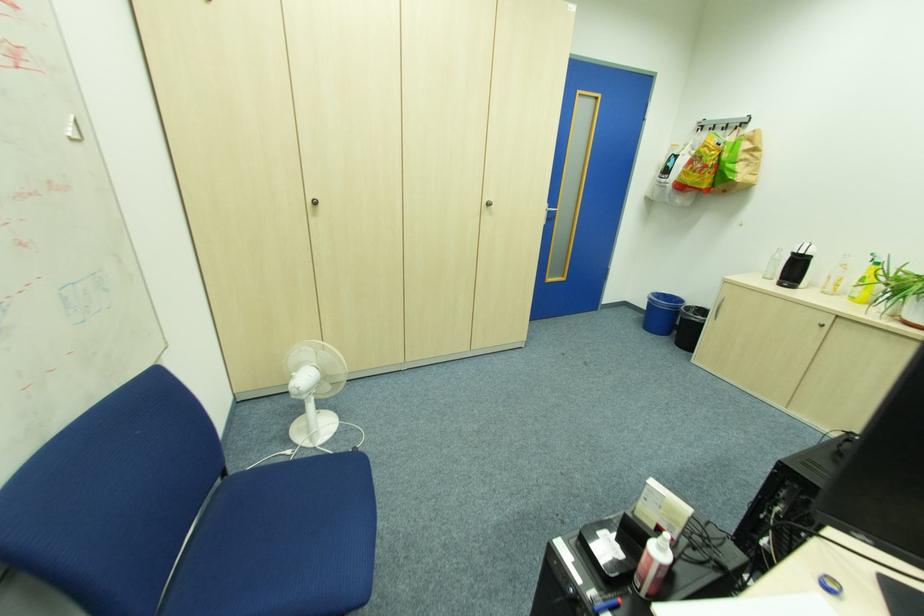
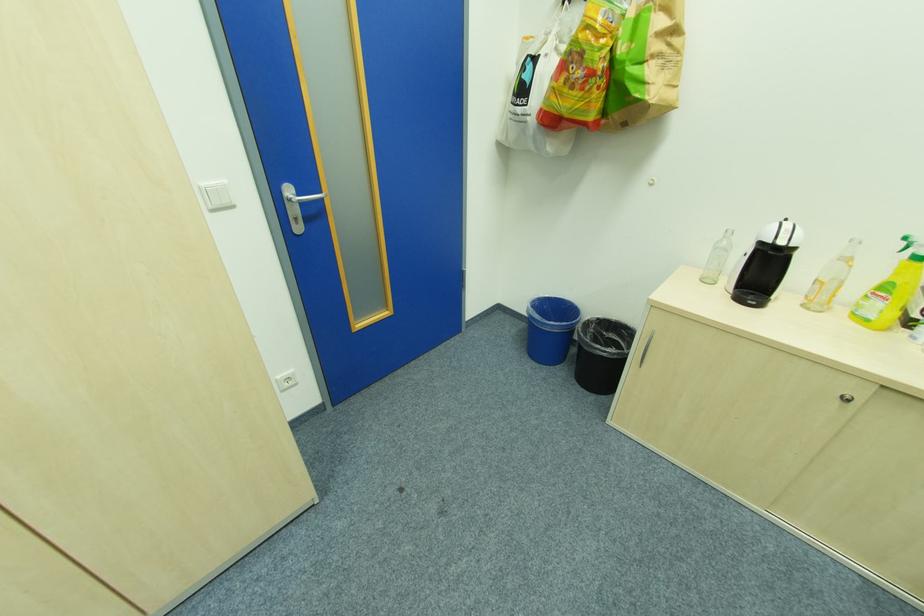
Locate, in the second image, the point that corresponds to the point at 783,254 in the first image.

(728, 238)